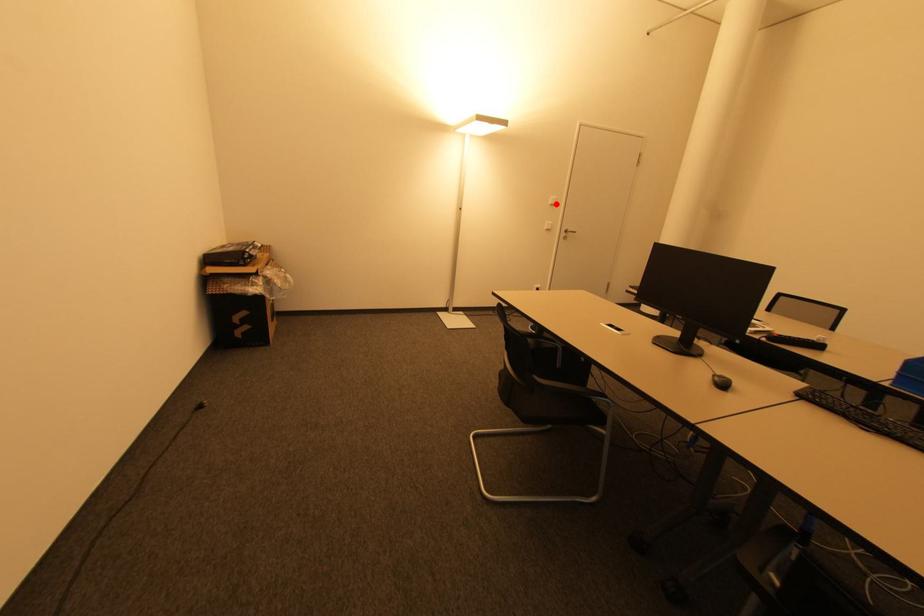
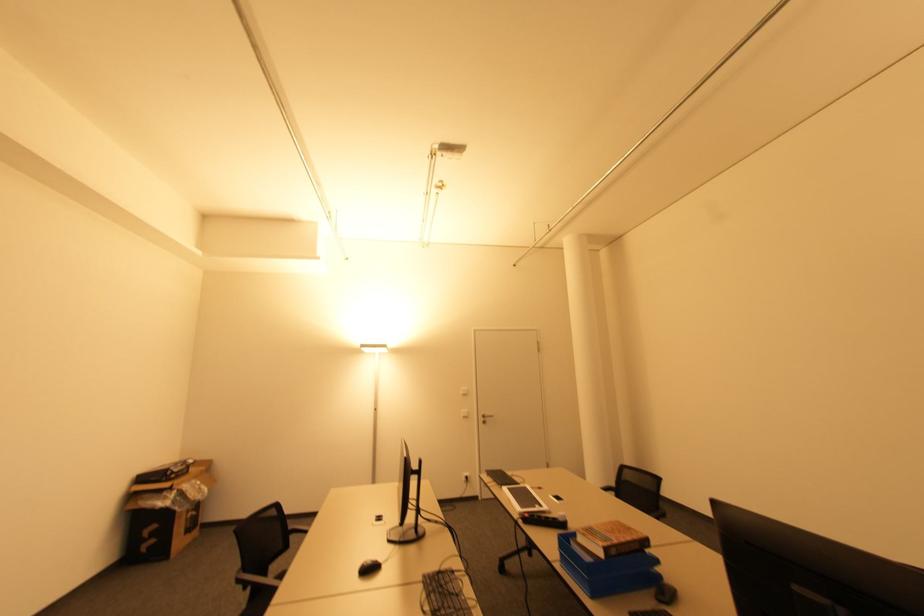
The point at the highlighted location is marked in the first image. Where is the corresponding point in the second image?

(468, 392)